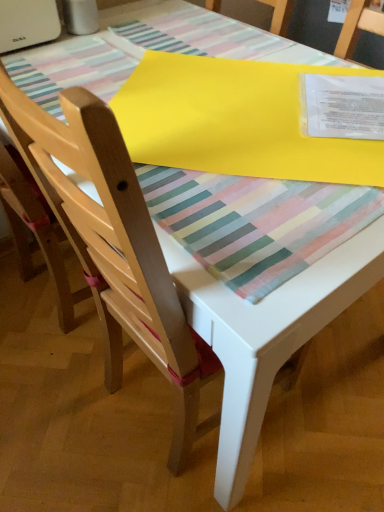
Question: From a real-world perspective, is yellow matte paper at upper center above or below light wood chair at left, which is counted as the second chair, starting from the right?

Choices:
 (A) above
 (B) below

Answer: (A)

Question: Relative to light wood chair at left, which is counted as the second chair, starting from the right, is yellow matte paper at upper center in front or behind?

Choices:
 (A) behind
 (B) front

Answer: (A)

Question: Which of these objects is positioned closest to the yellow matte paper at upper center?

Choices:
 (A) matte wood chair at center, which is the first chair in right-to-left order
 (B) light wood chair at left, which is counted as the first chair, starting from the left

Answer: (A)

Question: Based on their relative distances, which object is nearer to the matte wood chair at center, the second chair in the left-to-right sequence?

Choices:
 (A) light wood chair at left, which is counted as the first chair, starting from the left
 (B) yellow matte paper at upper center

Answer: (A)